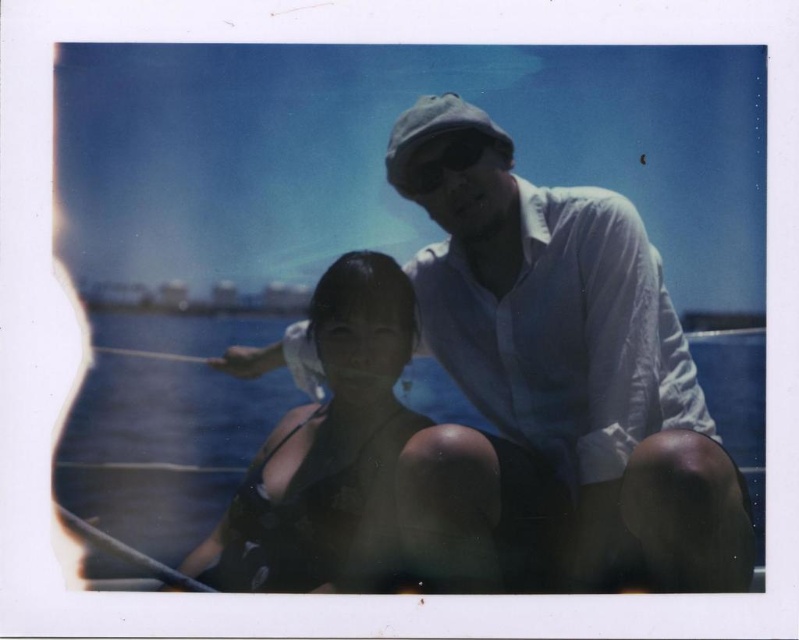
Looking at this image, who is taller, clear blue water at center or black matte swimsuit at center?

black matte swimsuit at center is taller.

Can you confirm if clear blue water at center is bigger than black matte swimsuit at center?

Yes.

Between point (133, 580) and point (289, 579), which one is positioned in front?

Point (133, 580) is more forward.

What are the coordinates of `clear blue water at center` in the screenshot? It's located at (165, 426).

Can you confirm if white cotton shirt at upper center is positioned above black matte swimsuit at center?

Yes, white cotton shirt at upper center is above black matte swimsuit at center.

Is white cotton shirt at upper center positioned in front of black matte swimsuit at center?

Yes, it is in front of black matte swimsuit at center.

Image resolution: width=799 pixels, height=640 pixels. Identify the location of white cotton shirt at upper center. (571, 355).

Who is shorter, white cotton shirt at upper center or clear blue water at center?

Standing shorter between the two is clear blue water at center.

The height and width of the screenshot is (640, 799). I want to click on white cotton shirt at upper center, so click(x=571, y=355).

I want to click on white cotton shirt at upper center, so click(571, 355).